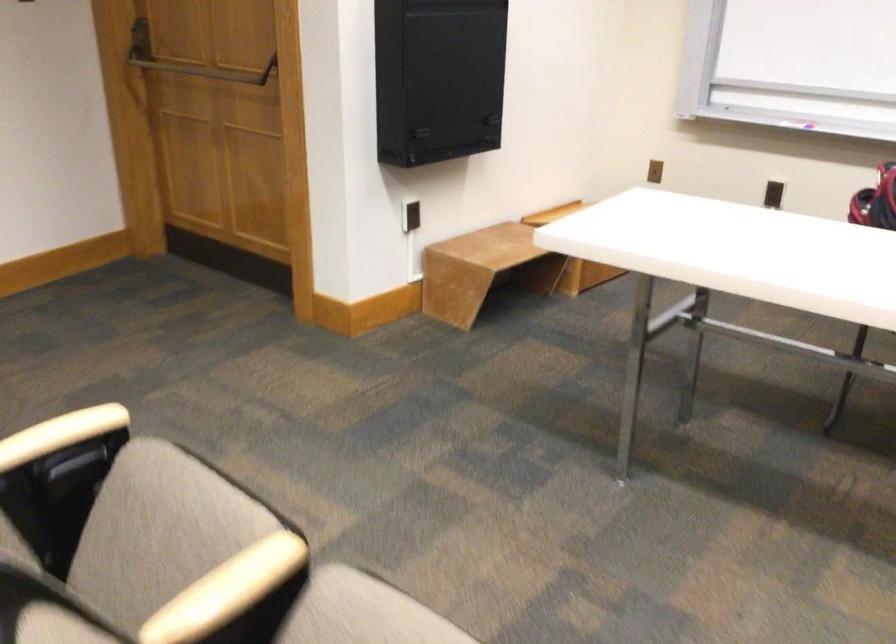
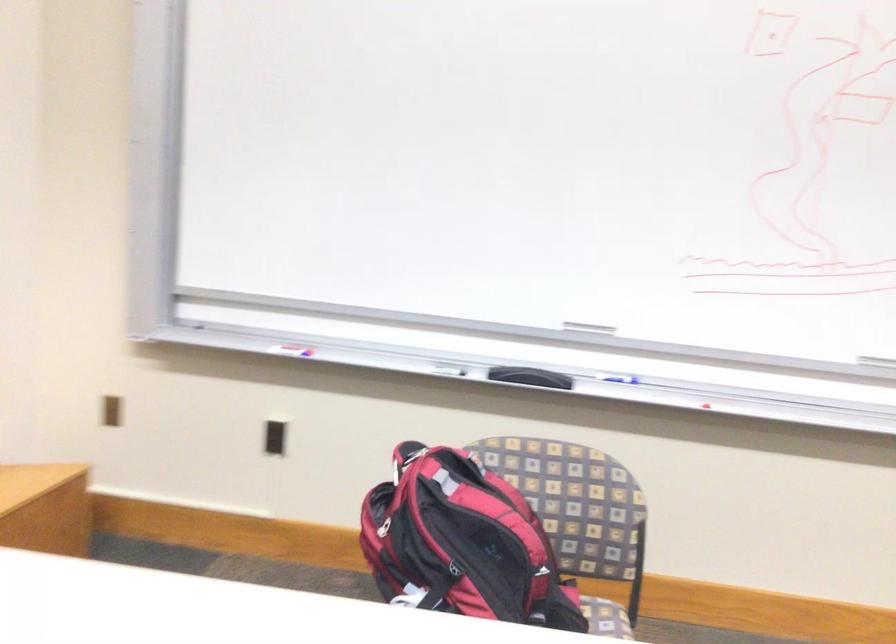
In the second image, find the point that corresponds to pixel 672 153 in the first image.

(112, 410)